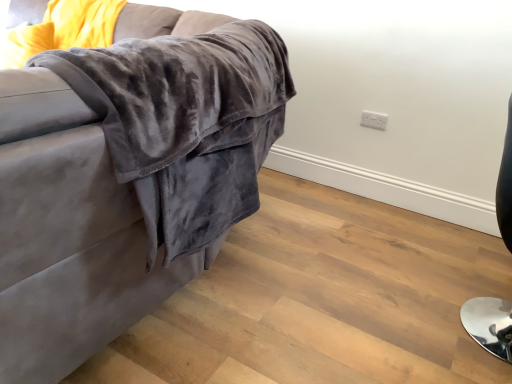
Question: From the image's perspective, is velvet gray couch at upper left above or below shiny black chair at right?

Choices:
 (A) below
 (B) above

Answer: (B)

Question: In terms of height, does velvet gray couch at upper left look taller or shorter compared to shiny black chair at right?

Choices:
 (A) short
 (B) tall

Answer: (B)

Question: Which object is the closest to the white plastic electric outlet at upper right?

Choices:
 (A) shiny black chair at right
 (B) velvet gray couch at upper left

Answer: (A)

Question: Which object is positioned farthest from the velvet gray couch at upper left?

Choices:
 (A) white plastic electric outlet at upper right
 (B) shiny black chair at right

Answer: (A)